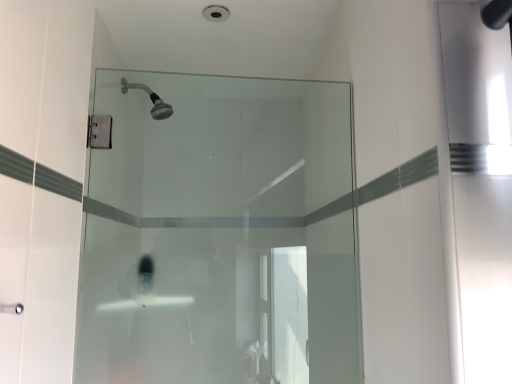
Measure the distance between point [348,370] and camera.

The depth of point [348,370] is 1.13 meters.

Measure the distance between transparent glass shower door at center and camera.

They are 3.41 feet apart.

The height and width of the screenshot is (384, 512). I want to click on transparent glass shower door at center, so click(x=219, y=233).

Describe the element at coordinates (219, 233) in the screenshot. I see `transparent glass shower door at center` at that location.

The width and height of the screenshot is (512, 384). I want to click on transparent glass shower door at center, so click(219, 233).